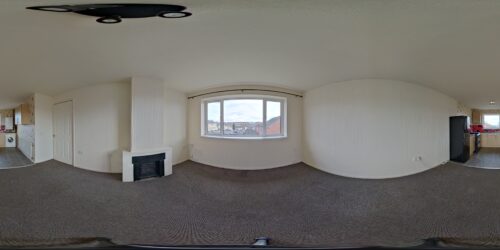
Locate an element on the screen. Image resolution: width=500 pixels, height=250 pixels. fireplace is located at coordinates (136, 157).